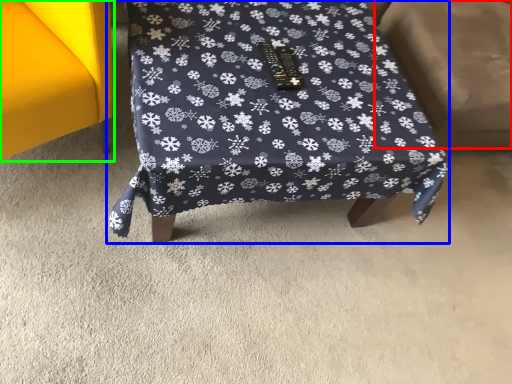
Question: Which object is positioned closest to swivel chair (highlighted by a red box)? Select from furniture (highlighted by a blue box) and furniture (highlighted by a green box).

Choices:
 (A) furniture
 (B) furniture

Answer: (A)